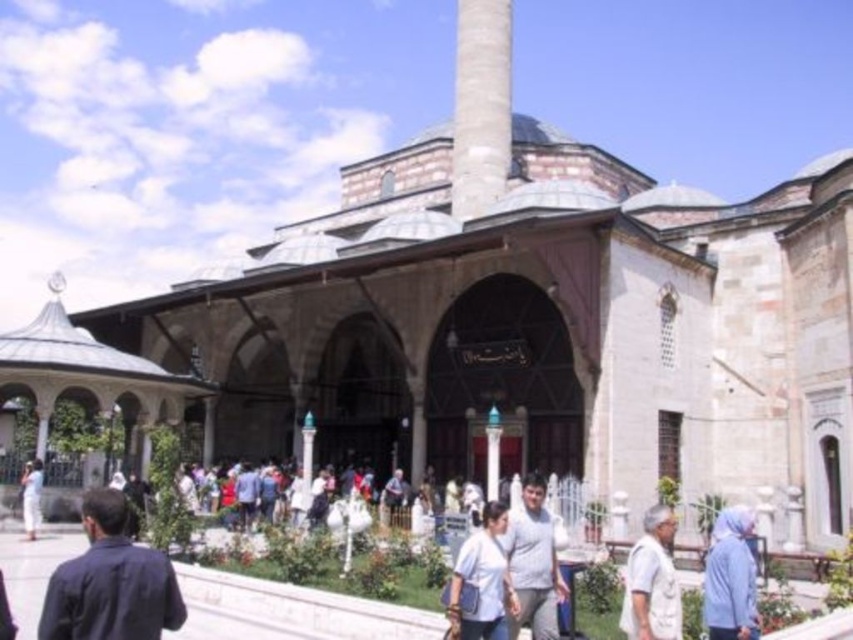
Question: Where is white cotton shirt at center located in relation to white cotton clothing at lower left in the image?

Choices:
 (A) below
 (B) above

Answer: (A)

Question: Which point is farther to the camera?

Choices:
 (A) (463, 588)
 (B) (532, 545)

Answer: (B)

Question: Which of the following is the farthest from the observer?

Choices:
 (A) (679, 600)
 (B) (467, 621)

Answer: (B)

Question: Which of these objects is positioned farthest from the gray cotton shirt at center?

Choices:
 (A) light blue fabric at lower right
 (B) white cotton clothing at lower left

Answer: (B)

Question: Can you confirm if light blue fabric at lower right is positioned below white cotton shirt at lower right?

Choices:
 (A) yes
 (B) no

Answer: (B)

Question: Does dark blue shirt at lower left lie behind light blue fabric at lower right?

Choices:
 (A) yes
 (B) no

Answer: (B)